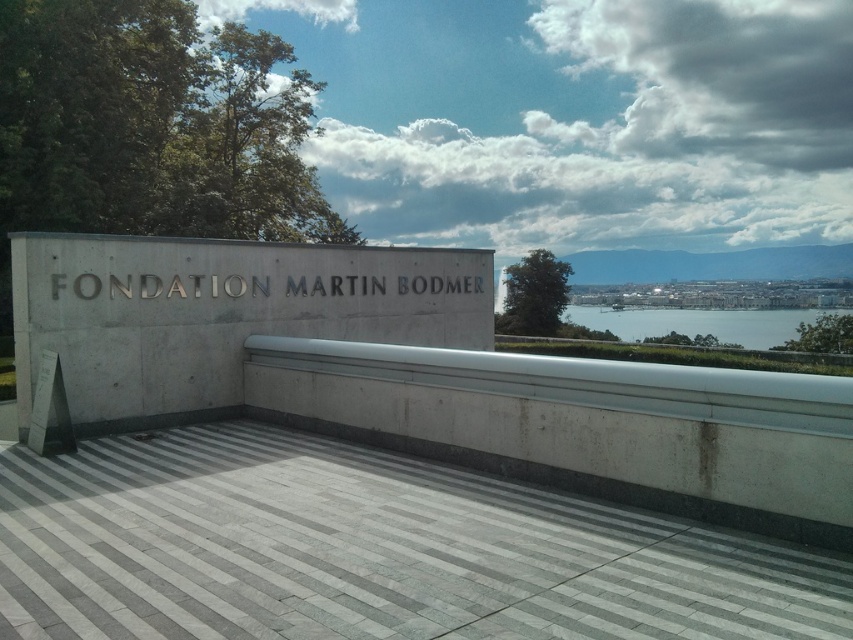
You are standing at the entrance of the Fondation Martin Bodmer and want to find the white concrete sign at center. According to the layout, where would you look relative to the entrance?

The white concrete sign at center is located at point coordinates (218, 314), so you should look towards the center area of the structure where these coordinates are positioned.

You are designing a layout for a new exhibit and need to place a 1.2 meter wide sculpture between the white concrete sign at center and the clear blue water at center. Based on their widths, will the sculpture fit between them?

The white concrete sign at center is thinner than clear blue water at center. However, the description does not provide specific measurements for their widths, so it is impossible to determine if the 1.2 meter wide sculpture will fit between them.

You are standing in front of the Fondation Martin Bodmer building and want to touch the point at coordinates point (x=415, y=285). If you can reach 3 feet, will you be able to touch it?

The point at coordinates point (x=415, y=285) is 34.16 feet away from the viewer. Since your reach is only 3 feet, you cannot touch it.